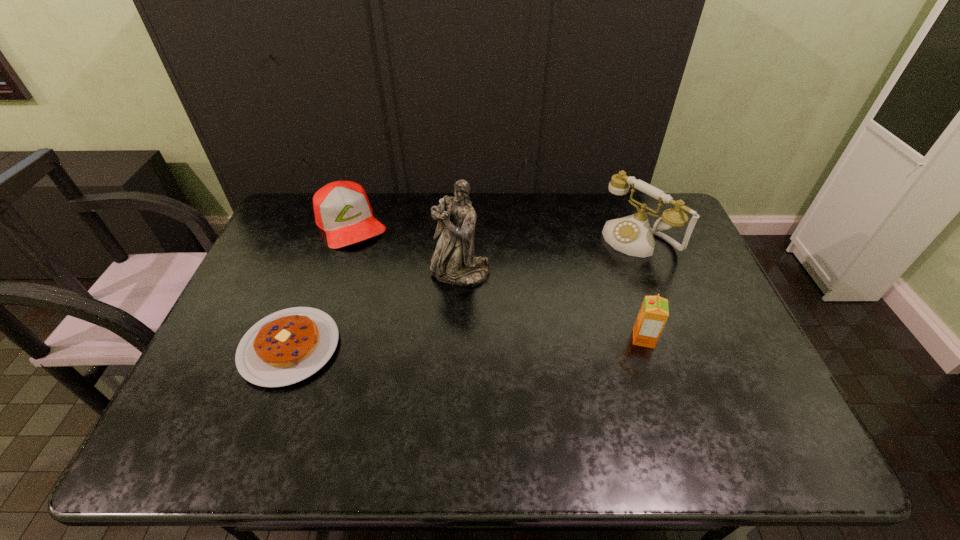
You are a GUI agent. You are given a task and a screenshot of the screen. Output one action in this format:
    pyautogui.click(x=<x>, y=<y>)
    Task: Click on the shortest object
    This screenshot has height=540, width=960.
    Given the screenshot: What is the action you would take?
    285,347

Find the location of a particular element. orange juice is located at coordinates (654, 312).

Locate an element on the screen. The image size is (960, 540). the fourth tallest object is located at coordinates click(x=342, y=209).

Where is `telephone`? The width and height of the screenshot is (960, 540). telephone is located at coordinates (632, 235).

Where is `figurine`? This screenshot has height=540, width=960. figurine is located at coordinates (453, 261).

This screenshot has height=540, width=960. Find the location of `the tallest object`. the tallest object is located at coordinates (453, 261).

The width and height of the screenshot is (960, 540). Find the location of `free space located on the back of the pancake`. free space located on the back of the pancake is located at coordinates (335, 226).

Identify the location of vacant space located 0.380m on the back of the orange juice. (611, 238).

Where is `free space located on the front-facing side of the fourth tallest object`? The width and height of the screenshot is (960, 540). free space located on the front-facing side of the fourth tallest object is located at coordinates (398, 301).

The width and height of the screenshot is (960, 540). I want to click on free space located on the front-facing side of the fourth tallest object, so click(x=398, y=301).